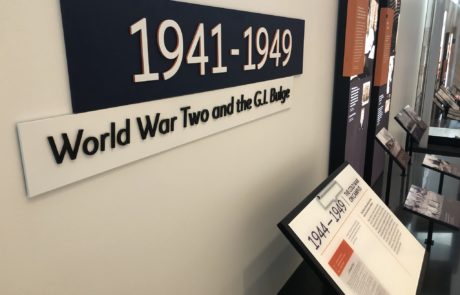
Find the location of `more document pedestals on upper right`. more document pedestals on upper right is located at coordinates (387, 150), (421, 116).